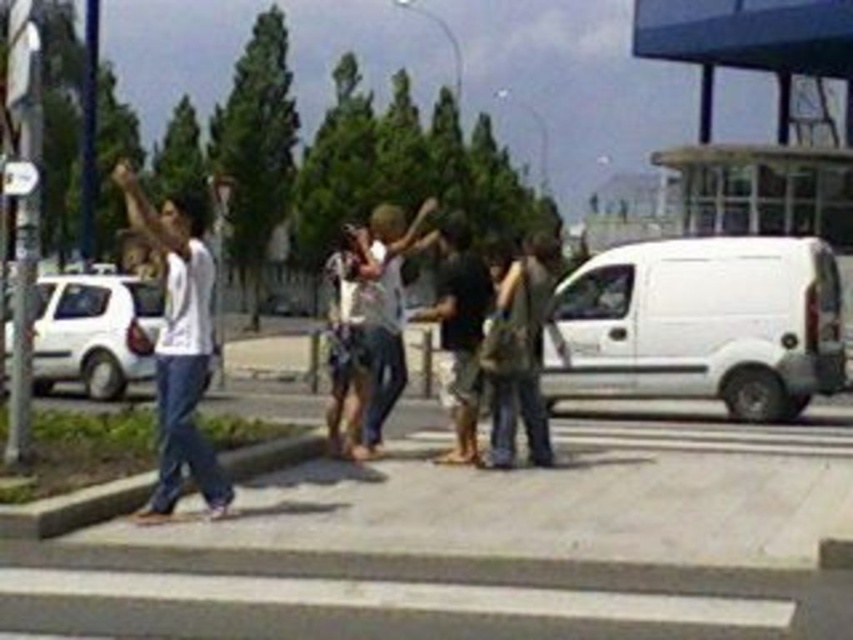
You are a fashion designer observing the group at the pedestrian crossing. You notice two individuals wearing a camouflage fabric shirt at center and a light brown leather jacket at center. Which clothing item has a smaller width?

The camouflage fabric shirt at center has a smaller width compared to the light brown leather jacket at center.

You are a delivery drone flying above the pedestrian crossing. Your GPS shows a point at coordinates (488, 540). What type of surface is located at those coordinates?

The point at coordinates (488, 540) corresponds to gray concrete pavement at center.